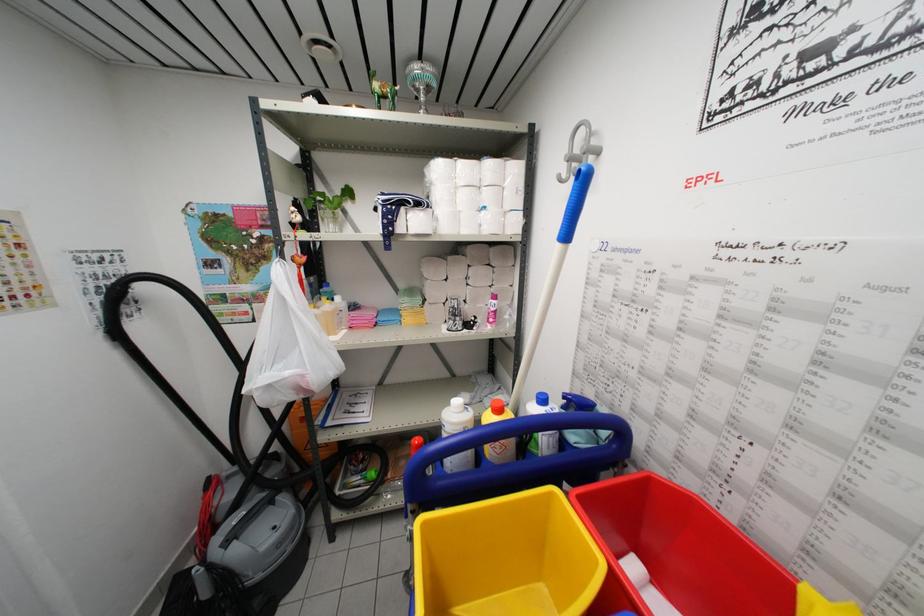
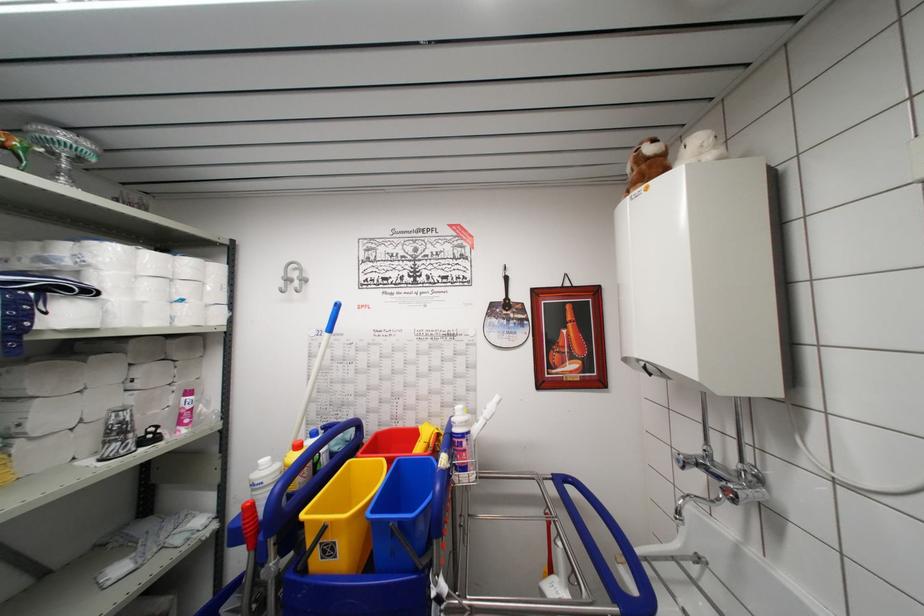
Locate, in the second image, the point that corresponds to pixel 490 201 in the first image.

(188, 294)